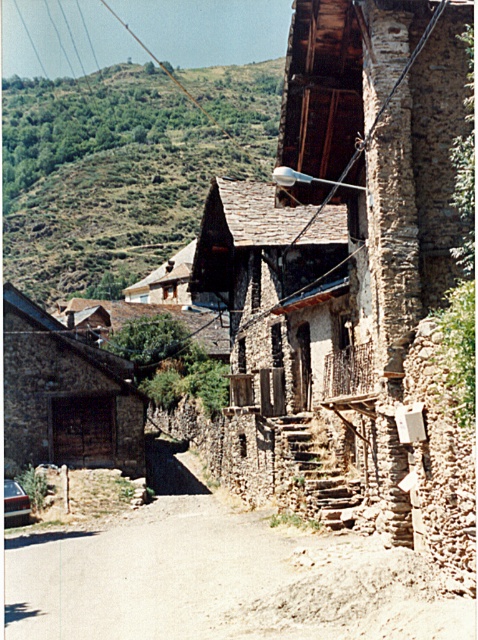
Between stone textured hut at lower left and metallic silver car at lower left, which one appears on the left side from the viewer's perspective?

From the viewer's perspective, stone textured hut at lower left appears more on the left side.

Does stone textured hut at lower left have a lesser height compared to metallic silver car at lower left?

Incorrect, stone textured hut at lower left's height does not fall short of metallic silver car at lower left's.

Which is in front, point (113, 444) or point (10, 506)?

Point (10, 506) is more forward.

Locate an element on the screen. The width and height of the screenshot is (478, 640). stone textured hut at lower left is located at coordinates (65, 396).

Does green grassy hillside at upper left appear on the left side of metallic silver car at lower left?

Indeed, green grassy hillside at upper left is positioned on the left side of metallic silver car at lower left.

Image resolution: width=478 pixels, height=640 pixels. I want to click on green grassy hillside at upper left, so click(121, 170).

You are a GUI agent. You are given a task and a screenshot of the screen. Output one action in this format:
    pyautogui.click(x=<x>, y=<y>)
    Task: Click on the green grassy hillside at upper left
    The width and height of the screenshot is (478, 640).
    Given the screenshot: What is the action you would take?
    pyautogui.click(x=121, y=170)

At what (x,y) coordinates should I click in order to perform the action: click on green grassy hillside at upper left. Please return your answer as a coordinate pair (x, y). The width and height of the screenshot is (478, 640). Looking at the image, I should click on pyautogui.click(x=121, y=170).

Can you confirm if metallic wire at upper center is shorter than stone textured hut at lower left?

No, metallic wire at upper center is not shorter than stone textured hut at lower left.

Does metallic wire at upper center have a larger size compared to stone textured hut at lower left?

Indeed, metallic wire at upper center has a larger size compared to stone textured hut at lower left.

Image resolution: width=478 pixels, height=640 pixels. I want to click on metallic wire at upper center, so click(x=127, y=99).